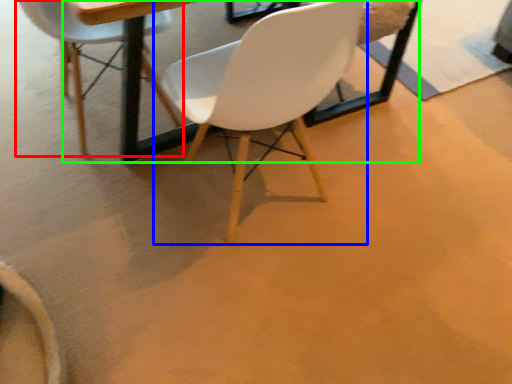
Question: Which object is positioned closest to chair (highlighted by a red box)? Select from chair (highlighted by a blue box) and round table (highlighted by a green box).

Choices:
 (A) chair
 (B) round table

Answer: (B)